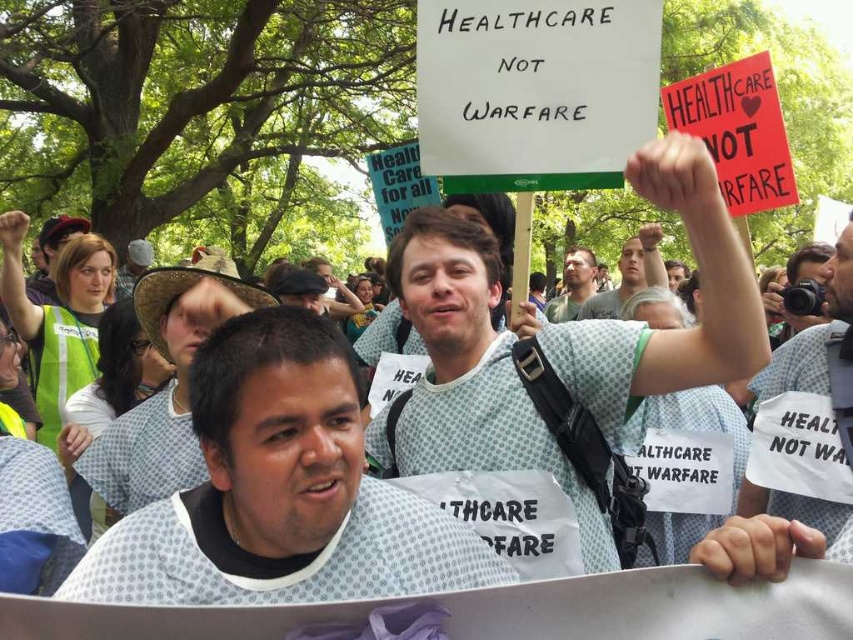
You are a photographer at the protest scene. You want to capture a photo that includes both the white dotted hospital gown at center and the light gray shirt at center. Based on their positions, which one should you adjust your camera angle to focus on first to ensure both are in frame?

The white dotted hospital gown at center is below the light gray shirt at center, so you should focus on the light gray shirt at center first to ensure the lower positioned white dotted hospital gown at center is also captured in the frame.

You are a photographer at the protest scene. You want to capture a photo of both the white dotted hospital gown at center and the light gray shirt at center. Which object should you zoom in on to ensure both are clearly visible in the frame?

You should zoom in on the light gray shirt at center because the white dotted hospital gown at center is wider than the light gray shirt at center, so focusing on the narrower one allows both to fit within the frame.